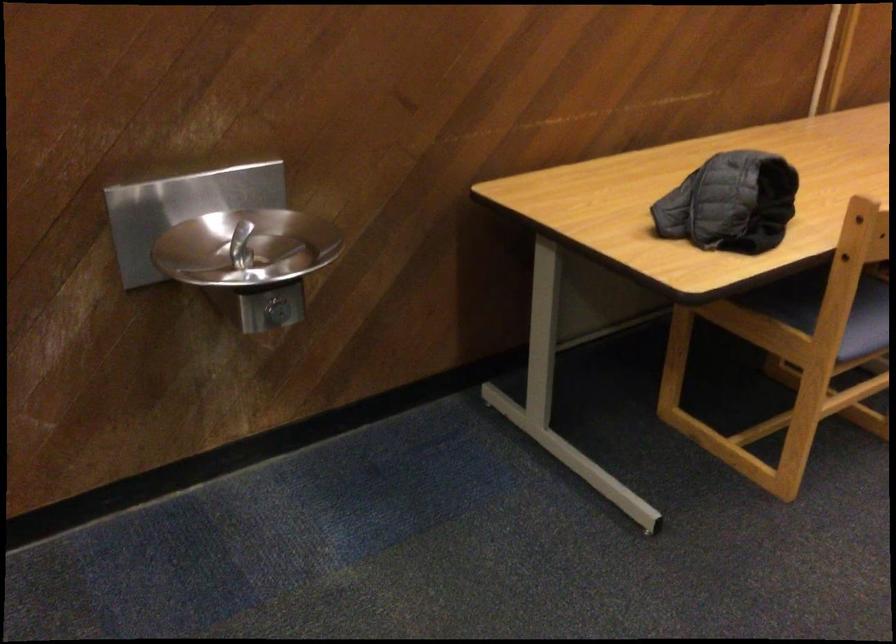
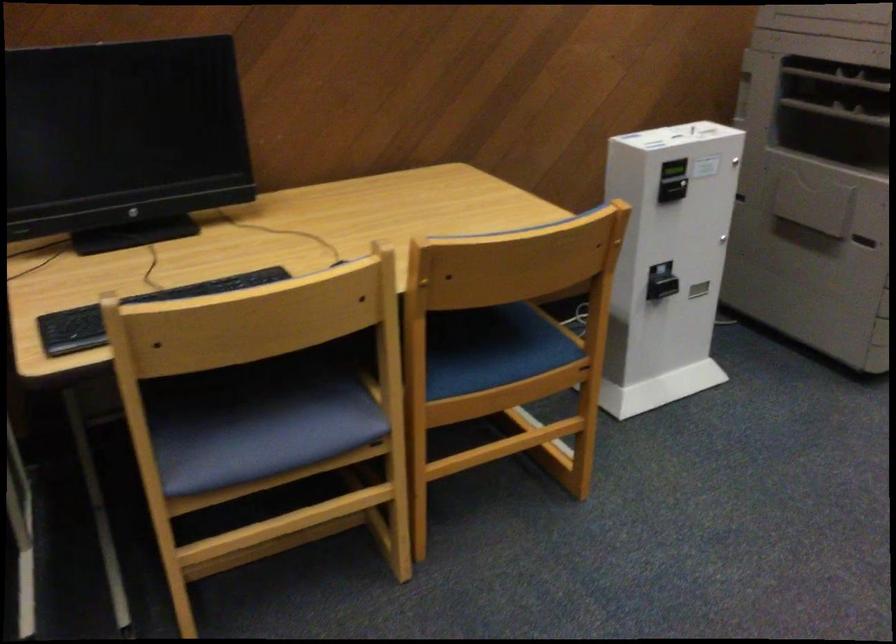
Which direction would the cameraman need to move to produce the second image?

The movement direction of the cameraman is right, forward.